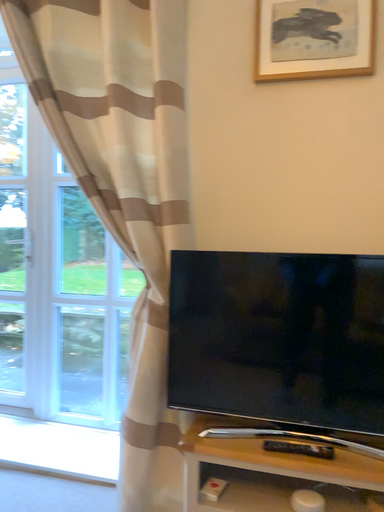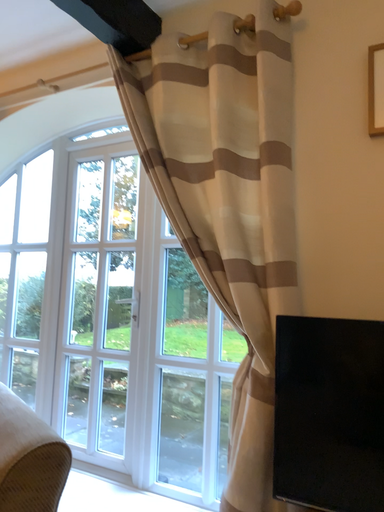
Question: How did the camera likely rotate when shooting the video?

Choices:
 (A) rotated right
 (B) rotated left

Answer: (B)